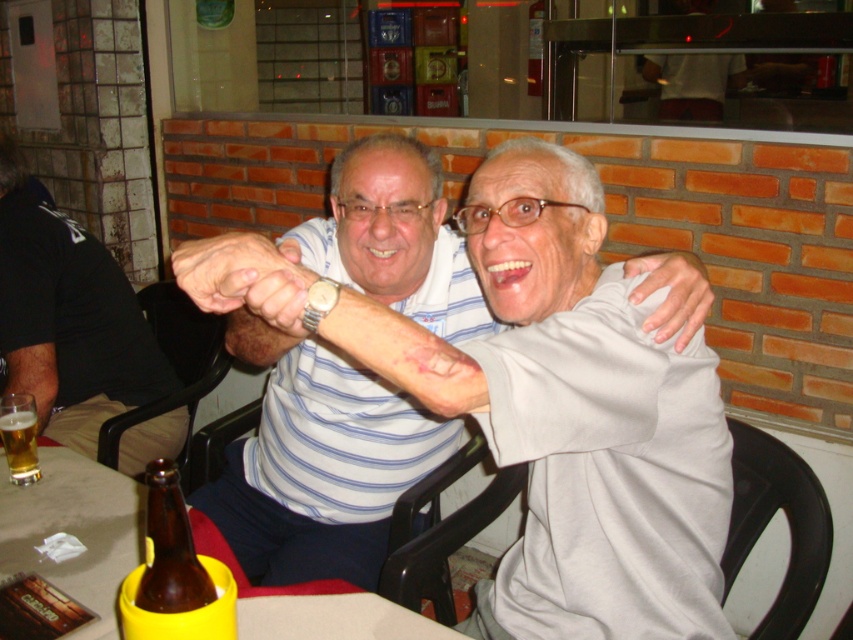
Question: Does brown glass bottle at lower left have a greater width compared to translucent glass mug at table left?

Choices:
 (A) yes
 (B) no

Answer: (A)

Question: Which point is farther to the camera?

Choices:
 (A) matte black shirt at left
 (B) smooth plastic table at center

Answer: (A)

Question: Which of these objects is positioned farthest from the smooth plastic table at center?

Choices:
 (A) brown glass bottle at lower left
 (B) matte black shirt at left

Answer: (B)

Question: Estimate the real-world distances between objects in this image. Which object is closer to the translucent glass mug at table left?

Choices:
 (A) brown glass bottle at lower left
 (B) smooth plastic table at center

Answer: (B)

Question: From the image, what is the correct spatial relationship of smooth plastic table at center in relation to translucent glass mug at table left?

Choices:
 (A) below
 (B) above

Answer: (A)

Question: Can you confirm if matte black shirt at left is thinner than brown glass bottle at lower left?

Choices:
 (A) no
 (B) yes

Answer: (A)